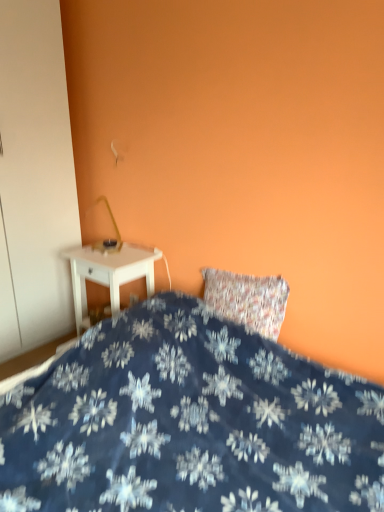
Question: Is white matte armoire at left spatially inside white plastic electric outlet at lower center, or outside of it?

Choices:
 (A) inside
 (B) outside

Answer: (B)

Question: Considering the positions of point tap(13, 7) and point tap(129, 302), is point tap(13, 7) closer or farther from the camera than point tap(129, 302)?

Choices:
 (A) closer
 (B) farther

Answer: (A)

Question: Which object is positioned closest to the white matte armoire at left?

Choices:
 (A) blue fabric bed at lower center
 (B) white glossy nightstand at left
 (C) white plastic electric outlet at lower center

Answer: (B)

Question: Which object is positioned farthest from the white glossy nightstand at left?

Choices:
 (A) white matte armoire at left
 (B) white plastic electric outlet at lower center
 (C) blue fabric bed at lower center

Answer: (C)